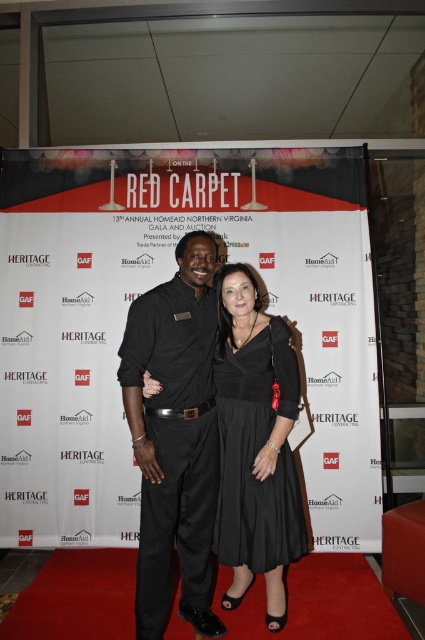
Who is more forward, (x=204, y=420) or (x=246, y=540)?

Point (x=204, y=420) is in front.

Measure the distance between black matte dress at center and camera.

black matte dress at center and camera are 2.16 meters apart from each other.

Identify the location of black matte dress at center. (175, 436).